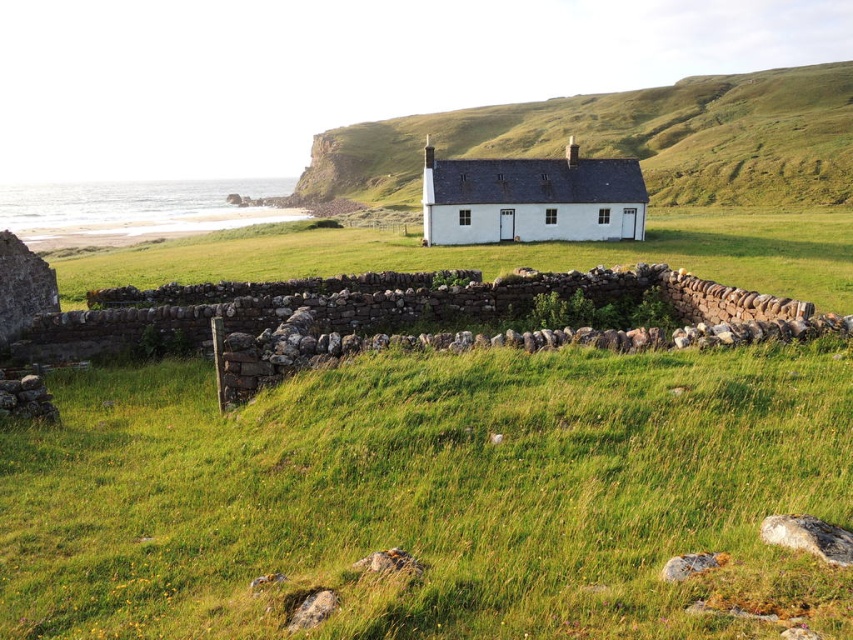
Question: Which of the following is the closest to the observer?

Choices:
 (A) white painted wood cottage at center
 (B) green grassy at center
 (C) green grassy field at center
 (D) green grassy hillside at center

Answer: (B)

Question: Which point is farther to the camera?

Choices:
 (A) (431, 209)
 (B) (757, 122)
 (C) (631, 436)

Answer: (B)

Question: Can you confirm if green grassy at center is wider than green grassy hillside at center?

Choices:
 (A) yes
 (B) no

Answer: (B)

Question: Does green grassy at center appear on the right side of green grassy hillside at center?

Choices:
 (A) no
 (B) yes

Answer: (A)

Question: Which object appears closest to the camera in this image?

Choices:
 (A) green grassy field at center
 (B) white painted wood cottage at center

Answer: (A)

Question: Can you confirm if green grassy at center is bigger than white painted wood cottage at center?

Choices:
 (A) yes
 (B) no

Answer: (B)